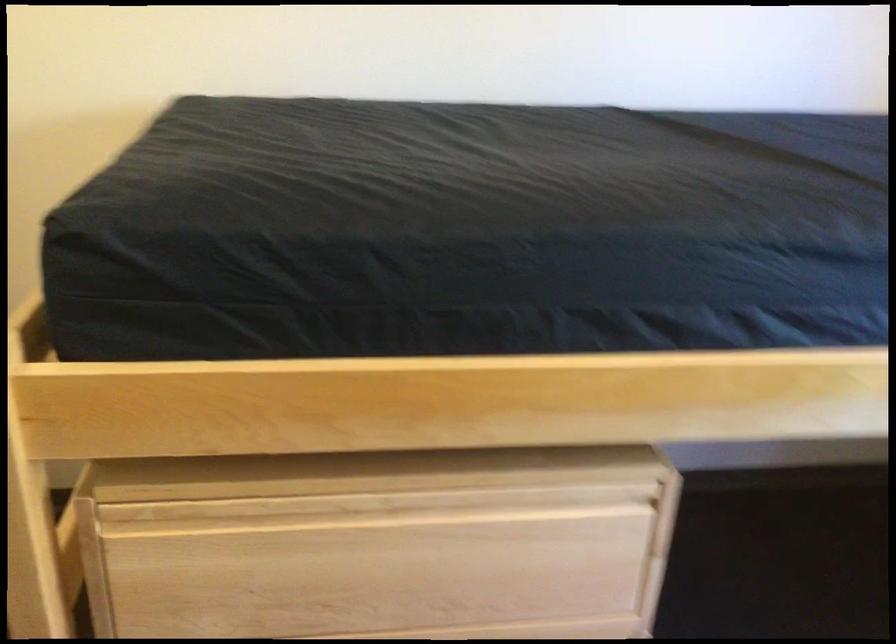
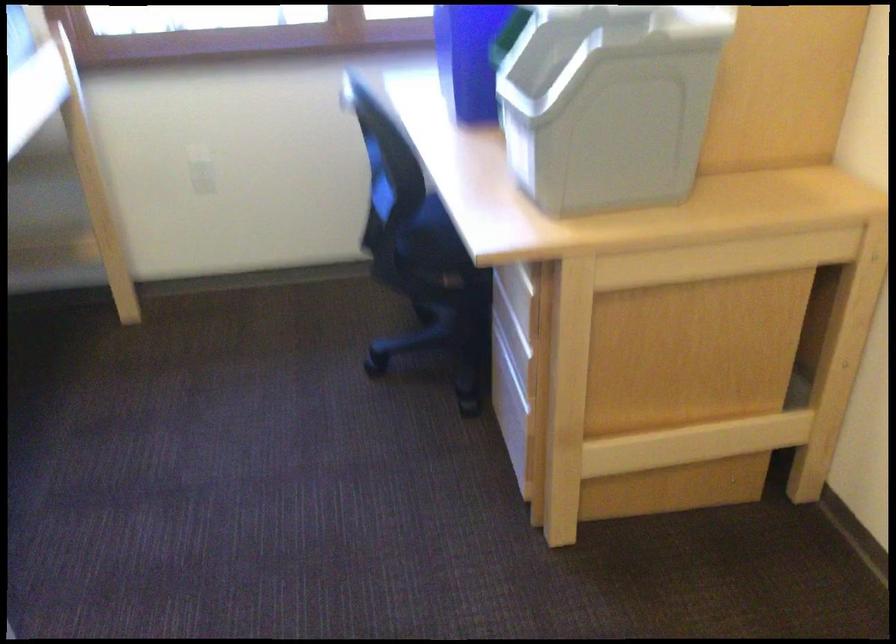
First-person continuous shooting, in which direction is the camera rotating?

The camera rotated toward right-down.